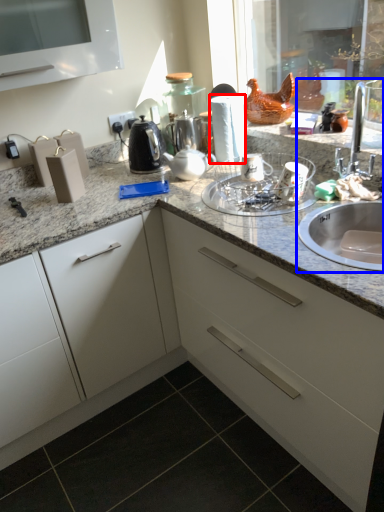
Question: Which object is further to the camera taking this photo, paper towel (highlighted by a red box) or sink (highlighted by a blue box)?

Choices:
 (A) paper towel
 (B) sink

Answer: (A)